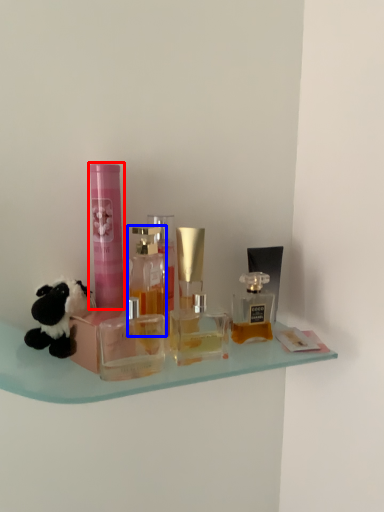
Question: Which of the following is the farthest to the observer, toiletry (highlighted by a red box) or bottle (highlighted by a blue box)?

Choices:
 (A) toiletry
 (B) bottle

Answer: (A)